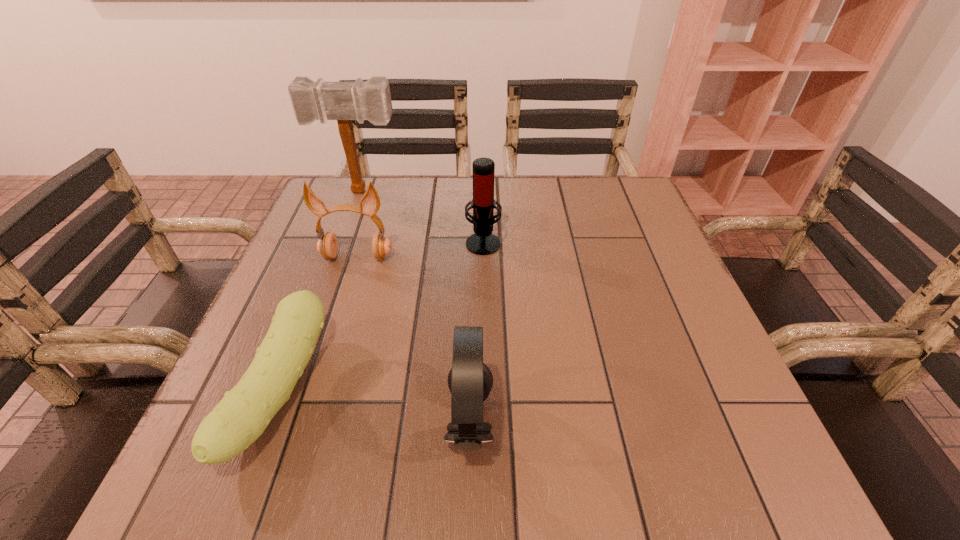
This screenshot has width=960, height=540. Find the location of `mallet`. mallet is located at coordinates (343, 101).

The image size is (960, 540). I want to click on the tallest object, so click(343, 101).

This screenshot has height=540, width=960. Identify the location of microphone. (483, 242).

Locate an element on the screen. The image size is (960, 540). the farther earphone is located at coordinates (327, 245).

Locate an element on the screen. the right earphone is located at coordinates (470, 381).

Identify the location of cucumber. (239, 419).

Where is `free space located 0.330m on the right of the mallet`? The height and width of the screenshot is (540, 960). free space located 0.330m on the right of the mallet is located at coordinates click(x=523, y=192).

Locate an element on the screen. vacant space located 0.310m on the right of the microphone is located at coordinates (633, 242).

Image resolution: width=960 pixels, height=540 pixels. I want to click on vacant space located on the front-facing side of the left earphone, so click(342, 306).

In order to click on vacant space located on the ear cups of the right earphone in this screenshot , I will do `click(733, 423)`.